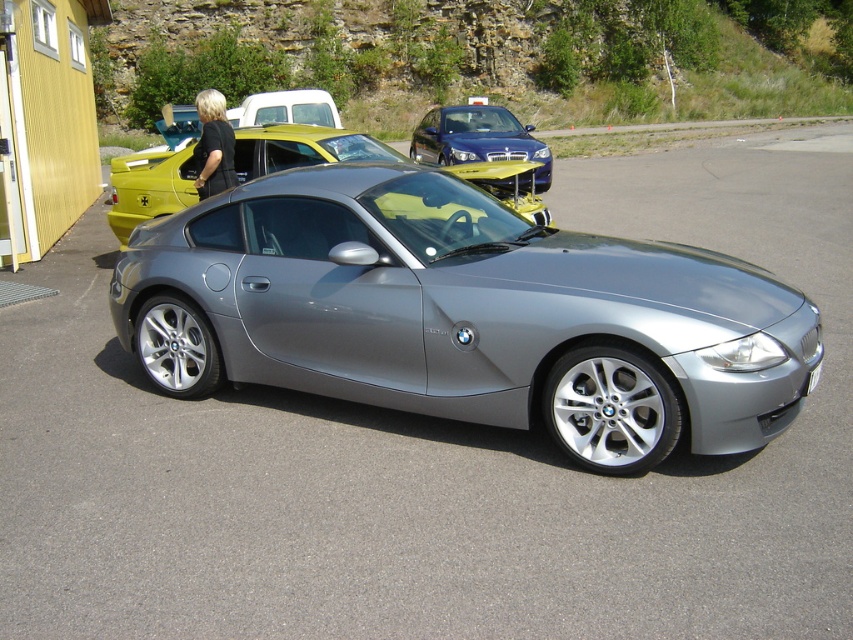
Does satin silver car at center appear on the right side of white plastic license plate at center?

No, satin silver car at center is not to the right of white plastic license plate at center.

Is the position of satin silver car at center more distant than that of white plastic license plate at center?

No, it is not.

This screenshot has height=640, width=853. What do you see at coordinates (463, 314) in the screenshot?
I see `satin silver car at center` at bounding box center [463, 314].

Find the location of a particular element. satin silver car at center is located at coordinates (463, 314).

Which of these two, metallic silver car at center or black plastic license plate at lower center, stands taller?

Standing taller between the two is metallic silver car at center.

Measure the distance between point (x=146, y=164) and camera.

Point (x=146, y=164) is 29.12 feet from camera.

Is point (138, 189) positioned before point (814, 372)?

No, (138, 189) is behind (814, 372).

You are a GUI agent. You are given a task and a screenshot of the screen. Output one action in this format:
    pyautogui.click(x=<x>, y=<y>)
    Task: Click on the metallic silver car at center
    The height and width of the screenshot is (640, 853).
    Given the screenshot: What is the action you would take?
    pyautogui.click(x=303, y=148)

What do you see at coordinates (477, 138) in the screenshot?
I see `metallic blue sedan at center` at bounding box center [477, 138].

Between metallic blue sedan at center and white plastic license plate at center, which one is positioned lower?

white plastic license plate at center is lower down.

Who is more forward, (548,154) or (517,156)?

Point (517,156)

The image size is (853, 640). In order to click on metallic blue sedan at center in this screenshot , I will do [x=477, y=138].